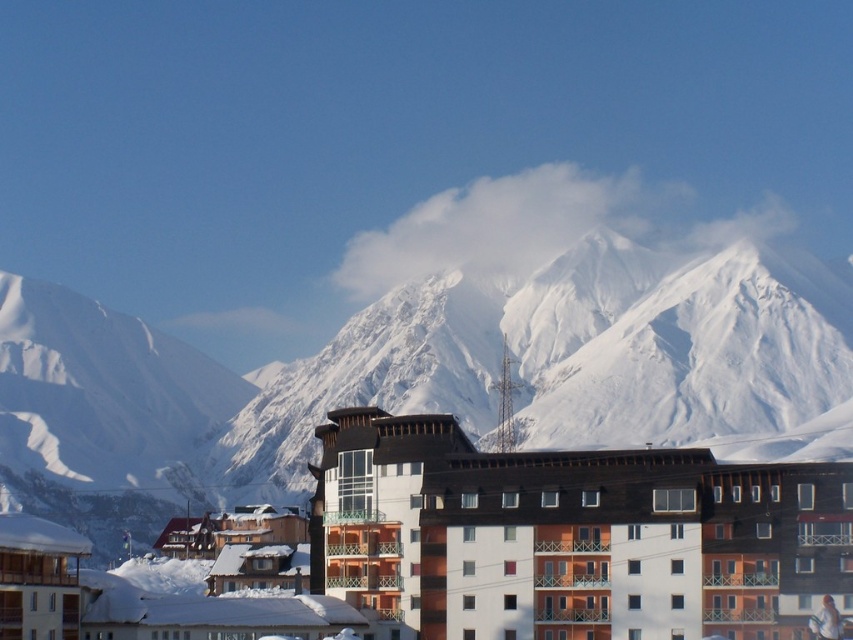
Consider the image. Is white snow-covered mountain at upper center positioned behind white snowboarder at center?

That is True.

Consider the image. Is white snow-covered mountain at upper center bigger than white snowboarder at center?

Yes, white snow-covered mountain at upper center is bigger than white snowboarder at center.

The width and height of the screenshot is (853, 640). What do you see at coordinates (424, 378) in the screenshot? I see `white snow-covered mountain at upper center` at bounding box center [424, 378].

The width and height of the screenshot is (853, 640). Identify the location of white snow-covered mountain at upper center. (424, 378).

Identify the location of white snow-covered mountain at upper center. This screenshot has width=853, height=640. (424, 378).

Can you confirm if white snow-covered mountain at upper center is positioned to the right of white wood apartment building at center?

No, white snow-covered mountain at upper center is not to the right of white wood apartment building at center.

What are the coordinates of `white snow-covered mountain at upper center` in the screenshot? It's located at (424, 378).

Between white wood apartment building at center and white snowboarder at center, which one appears on the left side from the viewer's perspective?

From the viewer's perspective, white wood apartment building at center appears more on the left side.

The width and height of the screenshot is (853, 640). Describe the element at coordinates (572, 536) in the screenshot. I see `white wood apartment building at center` at that location.

This screenshot has height=640, width=853. Find the location of `white wood apartment building at center`. white wood apartment building at center is located at coordinates (572, 536).